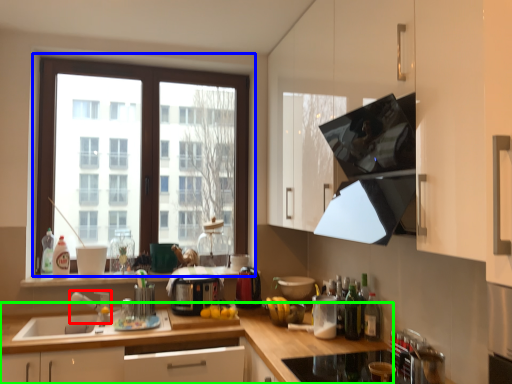
Question: Based on their relative distances, which object is farther from faucet (highlighted by a red box)? Choose from window (highlighted by a blue box) and cabinetry (highlighted by a green box).

Choices:
 (A) window
 (B) cabinetry

Answer: (A)